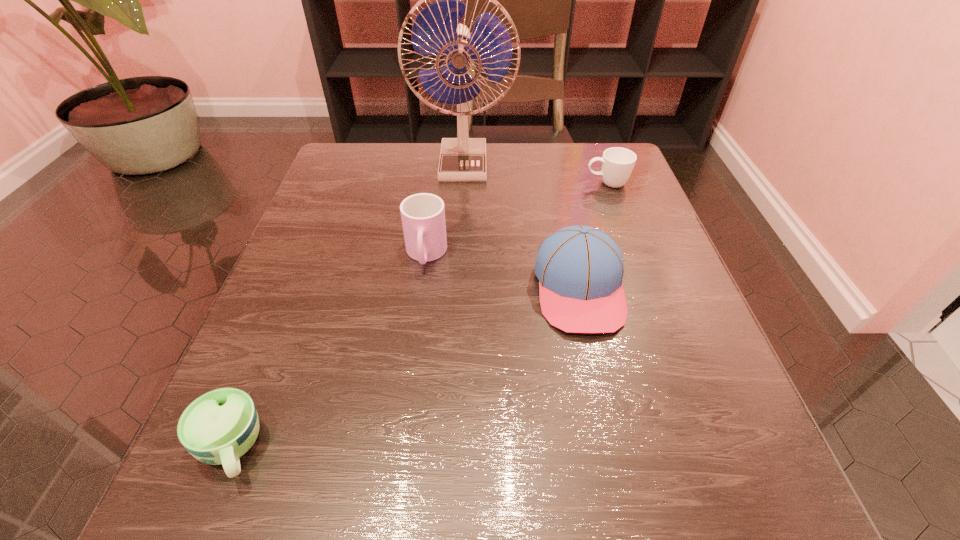
Identify the location of fan. Image resolution: width=960 pixels, height=540 pixels. (435, 30).

You are a GUI agent. You are given a task and a screenshot of the screen. Output one action in this format:
    pyautogui.click(x=<x>, y=<y>)
    Task: Click on the second cup from left to right
    The width and height of the screenshot is (960, 540).
    Given the screenshot: What is the action you would take?
    pyautogui.click(x=423, y=215)

This screenshot has width=960, height=540. In order to click on the second farthest cup in this screenshot , I will do tap(423, 215).

At what (x,y) coordinates should I click in order to perform the action: click on baseball cap. Please return your answer as a coordinate pair (x, y). Looking at the image, I should click on (580, 269).

Identify the location of the farthest cup. (617, 163).

Image resolution: width=960 pixels, height=540 pixels. Identify the location of the nearest cup. (220, 426).

Locate an element on the screen. the leftmost object is located at coordinates (220, 426).

I want to click on free space located on the front-facing side of the fan, so click(x=459, y=259).

Where is `vacant region located with the handle on the side of the second cup from left to right`? The height and width of the screenshot is (540, 960). vacant region located with the handle on the side of the second cup from left to right is located at coordinates (420, 302).

The width and height of the screenshot is (960, 540). I want to click on free space located 0.080m on the front-facing side of the baseball cap, so click(x=600, y=383).